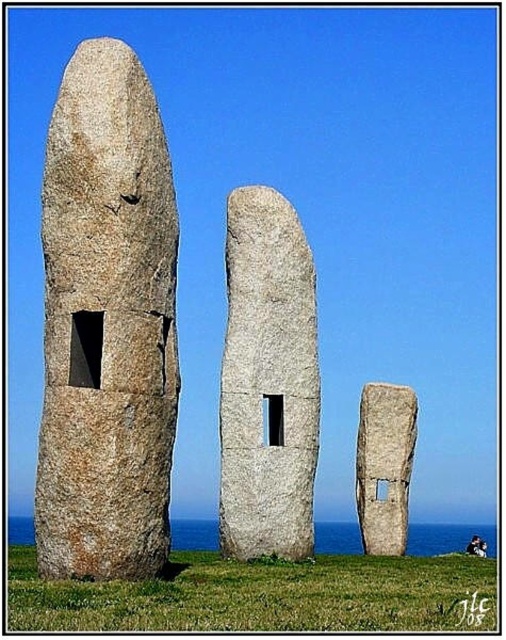
You are a photographer setting up a tripod to capture the granite stone at left and the smooth gray stone at center. If you want to ensure both stones are fully visible in your shot, should you adjust your camera angle upwards or downwards?

Since the granite stone at left is above the smooth gray stone at center, you should adjust your camera angle downwards to capture both stones fully in your shot.

You are a landscape architect designing a new garden layout. You need to place a statue that requires a base taller than 2 meters. Given the granite stone at left and the gray stone monolith at center, which one would be suitable as a base?

The granite stone at left has a greater height compared to the gray stone monolith at center, so it would be suitable as a base for the statue requiring a base taller than 2 meters.